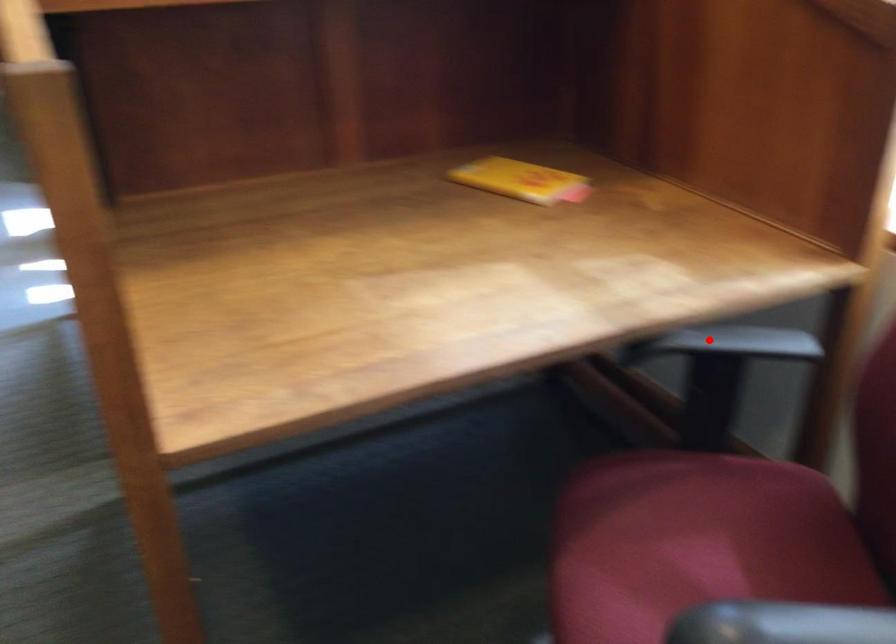
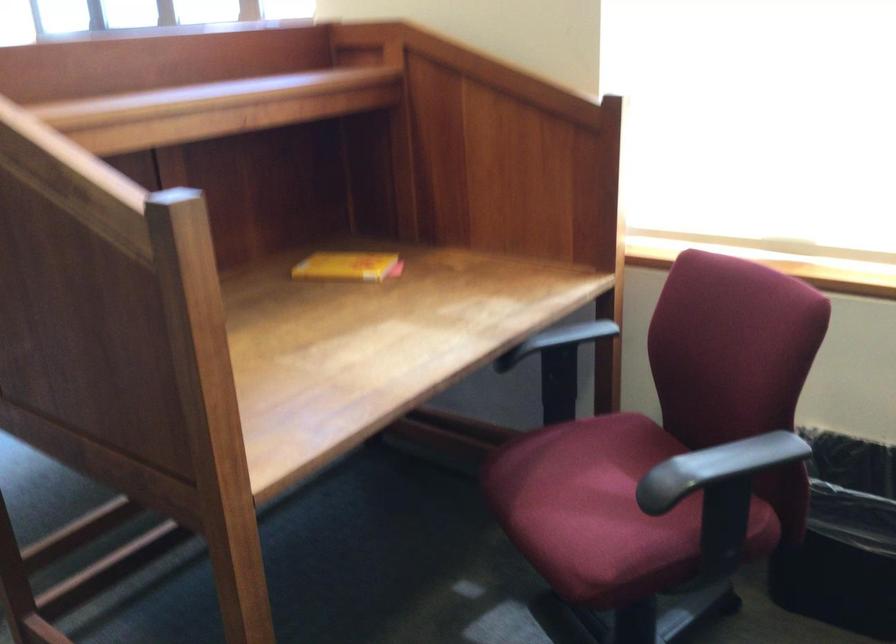
Question: I am providing you with two images of the same scene from different viewpoints. A red point is shown in image1. For the corresponding object point in image2, is it positioned nearer or farther from the camera?

Choices:
 (A) Nearer
 (B) Farther

Answer: (B)